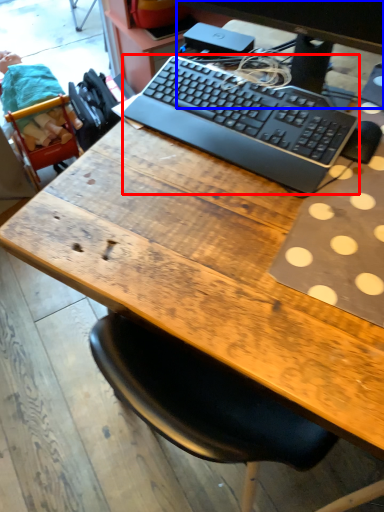
Question: Among these objects, which one is farthest to the camera, computer keyboard (highlighted by a red box) or computer monitor (highlighted by a blue box)?

Choices:
 (A) computer keyboard
 (B) computer monitor

Answer: (A)